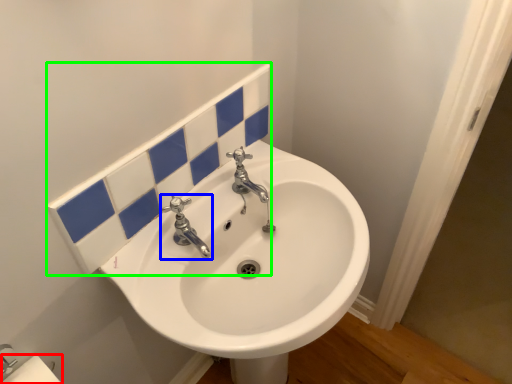
Question: Considering the real-world distances, which object is closest to toilet paper (highlighted by a red box)? tap (highlighted by a blue box) or tile (highlighted by a green box).

Choices:
 (A) tap
 (B) tile

Answer: (A)